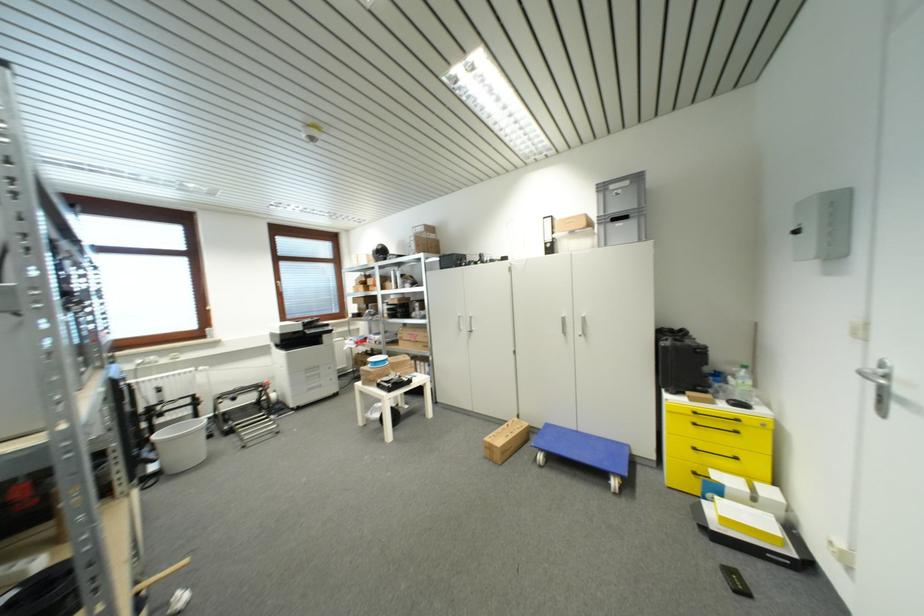
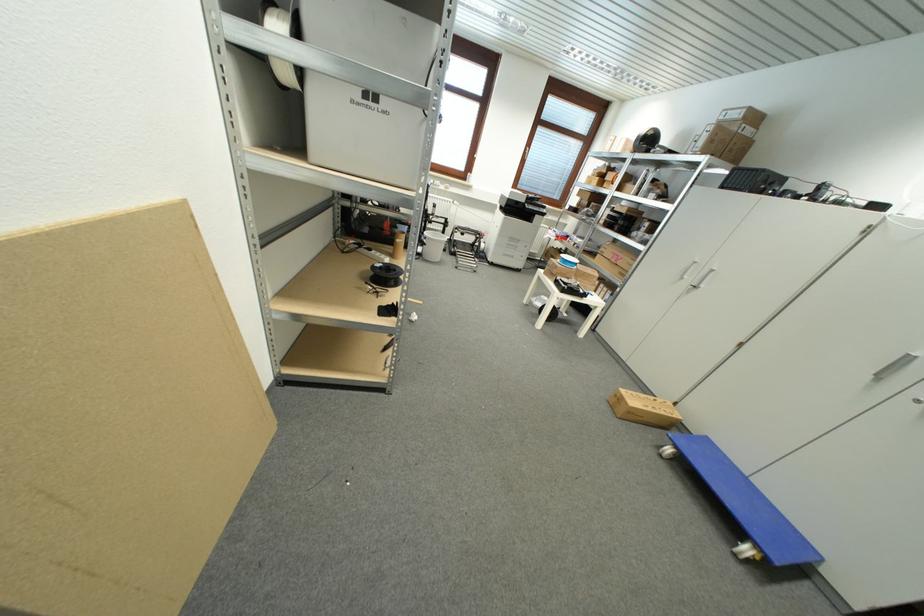
Where in the second image is the point corresponding to [419,341] from the first image?

(621, 262)